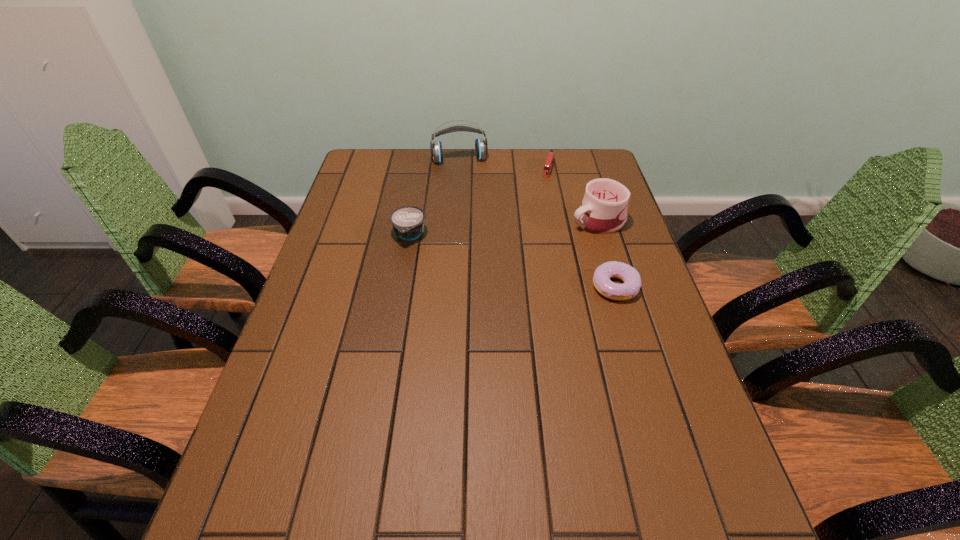
This screenshot has height=540, width=960. I want to click on yogurt, so tap(408, 222).

At what (x,y) coordinates should I click in order to perform the action: click on doughnut. Please return your answer as a coordinate pair (x, y). Image resolution: width=960 pixels, height=540 pixels. Looking at the image, I should click on (630, 288).

The height and width of the screenshot is (540, 960). Identify the location of the tallest object. (481, 148).

This screenshot has height=540, width=960. Find the location of `mug`. mug is located at coordinates (603, 210).

Where is `stapler`? stapler is located at coordinates (550, 159).

At what (x,y) coordinates should I click in order to perform the action: click on free region located 0.230m on the front of the third tallest object. Please return your answer as a coordinate pair (x, y). Looking at the image, I should click on (396, 309).

This screenshot has width=960, height=540. Find the location of `free point located 0.240m on the front of the doughnut`. free point located 0.240m on the front of the doughnut is located at coordinates (645, 387).

This screenshot has height=540, width=960. I want to click on free space located 0.130m on the ear cups of the headset, so click(468, 187).

This screenshot has height=540, width=960. I want to click on free region located 0.080m on the ear cups of the headset, so click(466, 179).

Locate an element on the screen. free location located 0.300m on the ear cups of the headset is located at coordinates (473, 217).